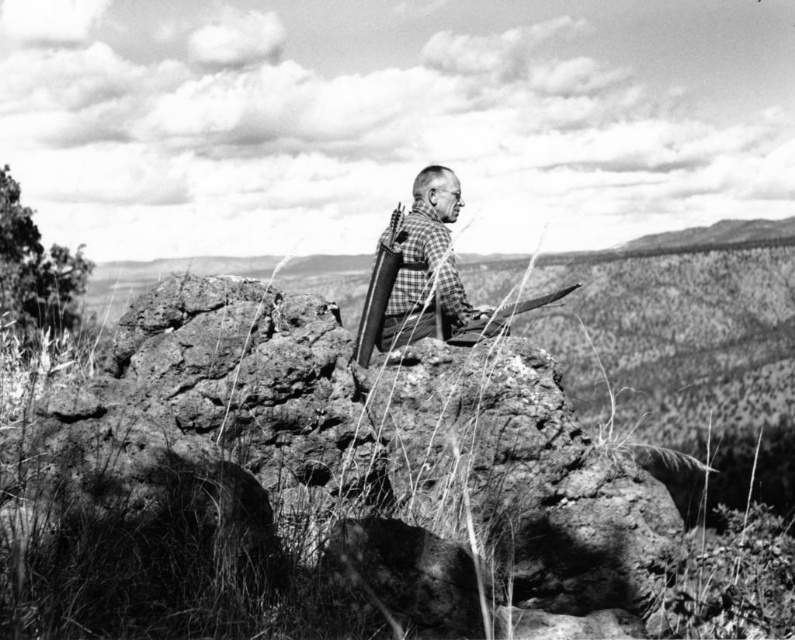
Question: Which point appears closest to the camera in this image?

Choices:
 (A) (316, 372)
 (B) (454, 195)
 (C) (394, 246)

Answer: (A)

Question: Which point appears closest to the camera in this image?

Choices:
 (A) (419, 237)
 (B) (388, 262)

Answer: (B)

Question: Which of the following is the closest to the observer?

Choices:
 (A) (394, 273)
 (B) (611, 582)
 (C) (429, 284)

Answer: (B)

Question: Can you confirm if rough textured rock at center is positioned to the left of checkered fabric shirt at center?

Choices:
 (A) no
 (B) yes

Answer: (B)

Question: Observing the image, what is the correct spatial positioning of checkered fabric shirt at center in reference to polished metal rifle at center?

Choices:
 (A) above
 (B) below

Answer: (A)

Question: Is the position of rough textured rock at center less distant than that of polished metal rifle at center?

Choices:
 (A) no
 (B) yes

Answer: (B)